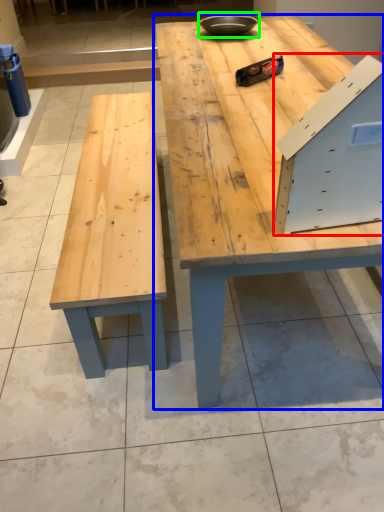
Question: Considering the real-world distances, which object is farthest from drawer (highlighted by a red box)? table (highlighted by a blue box) or bowl (highlighted by a green box)?

Choices:
 (A) table
 (B) bowl

Answer: (B)